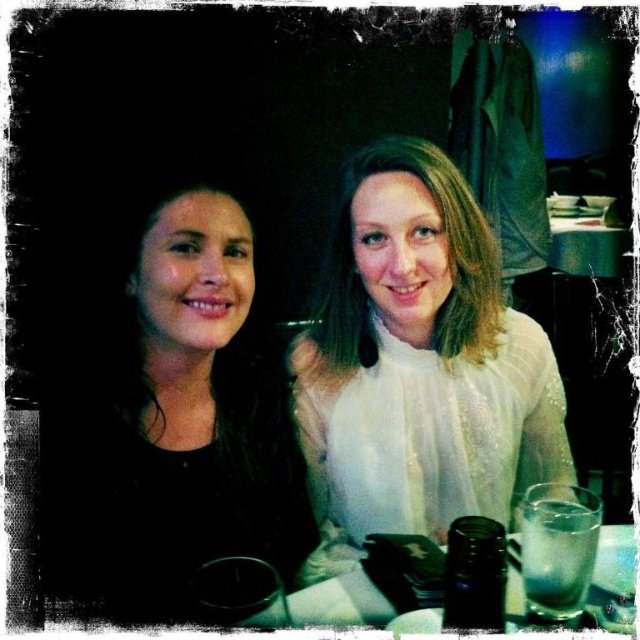
Is black matte hair at left further to camera compared to white lace blouse at center?

No, it is in front of white lace blouse at center.

Does black matte hair at left appear on the left side of white lace blouse at center?

Correct, you'll find black matte hair at left to the left of white lace blouse at center.

This screenshot has width=640, height=640. I want to click on black matte hair at left, so click(170, 412).

This screenshot has height=640, width=640. What do you see at coordinates (170, 412) in the screenshot?
I see `black matte hair at left` at bounding box center [170, 412].

Does point (116, 531) lie behind point (573, 611)?

Yes, point (116, 531) is behind point (573, 611).

Who is more forward, [298,540] or [593,545]?

Point [593,545]

The image size is (640, 640). Find the location of `black matte hair at left`. black matte hair at left is located at coordinates (170, 412).

Does white lace blouse at center appear on the right side of clear glass at right?

In fact, white lace blouse at center is to the left of clear glass at right.

Is point (380, 392) in front of point (520, 518)?

Yes, it is in front of point (520, 518).

Does point (328, 394) come behind point (536, 541)?

Yes, it is.

Identify the location of white lace blouse at center. The width and height of the screenshot is (640, 640). (420, 364).